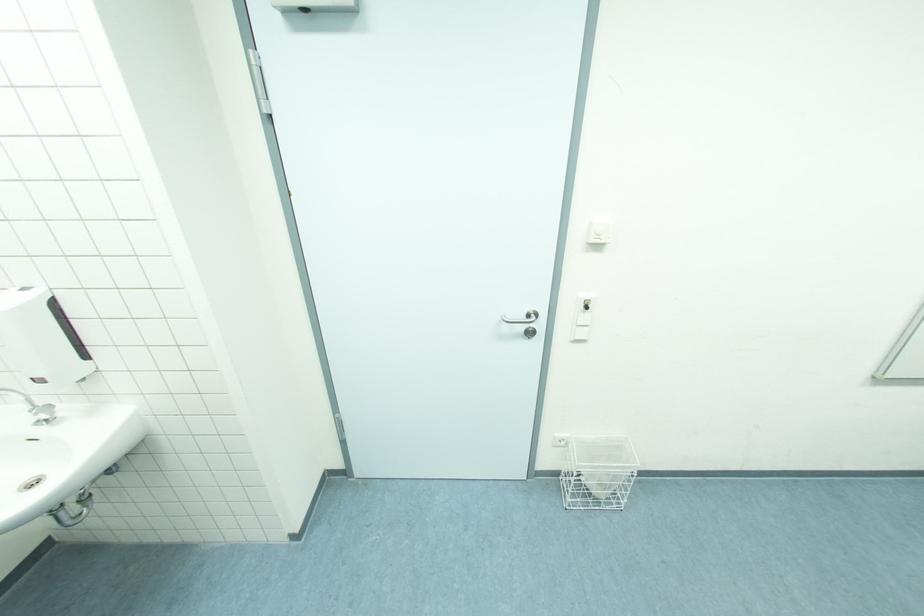
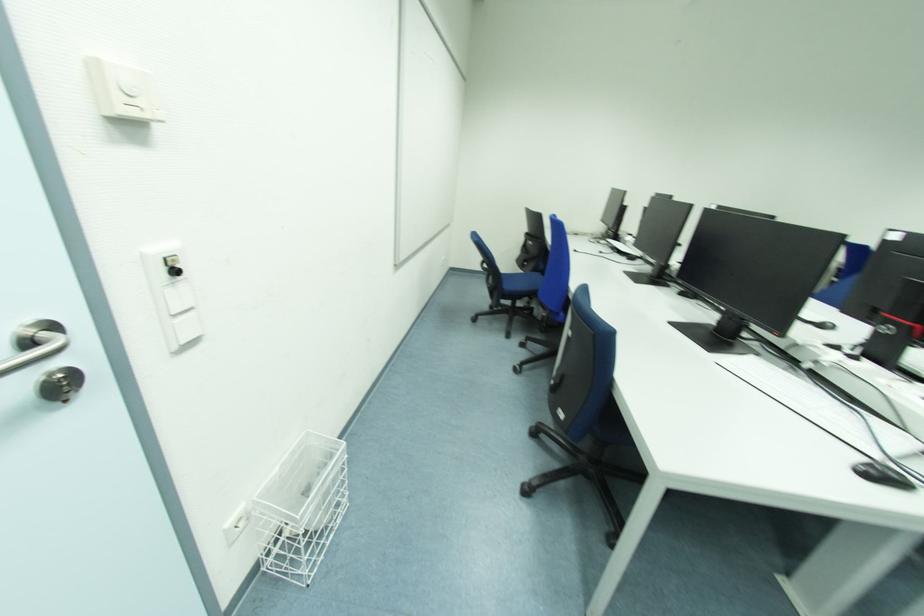
Where in the second image is the point corresponding to the point at 580,328 from the first image?

(177, 317)